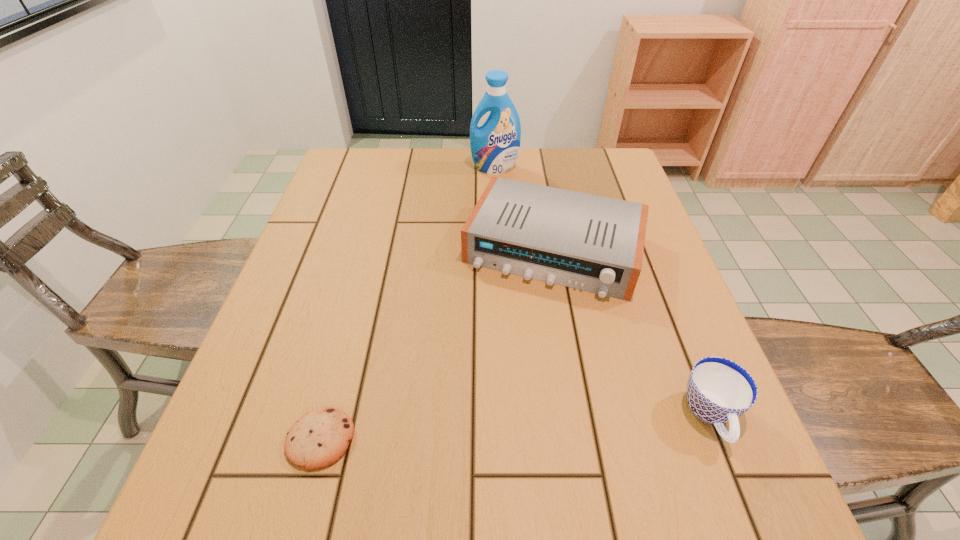
This screenshot has height=540, width=960. Identify the location of vacant space located on the front-facing side of the farthest object. (496, 229).

Find the location of a particular element. The height and width of the screenshot is (540, 960). vacant space located on the control panel of the radio receiver is located at coordinates (493, 400).

This screenshot has height=540, width=960. I want to click on vacant space situated on the control panel of the radio receiver, so click(491, 409).

Image resolution: width=960 pixels, height=540 pixels. What are the coordinates of `free space located 0.260m on the control panel of the radio receiver` in the screenshot? It's located at (493, 400).

Identify the location of object that is at the far edge. (495, 145).

At what (x,y) coordinates should I click in order to perform the action: click on cookie that is positioned at the near edge. Please return your answer as a coordinate pair (x, y). The image size is (960, 540). Looking at the image, I should click on (317, 440).

What are the coordinates of `cup that is at the near edge` in the screenshot? It's located at (719, 390).

Locate an element on the screen. The height and width of the screenshot is (540, 960). object present at the left edge is located at coordinates (317, 440).

Where is `cup located at the right edge`? cup located at the right edge is located at coordinates (719, 390).

Locate an element on the screen. This screenshot has height=540, width=960. radio receiver that is at the right edge is located at coordinates (592, 243).